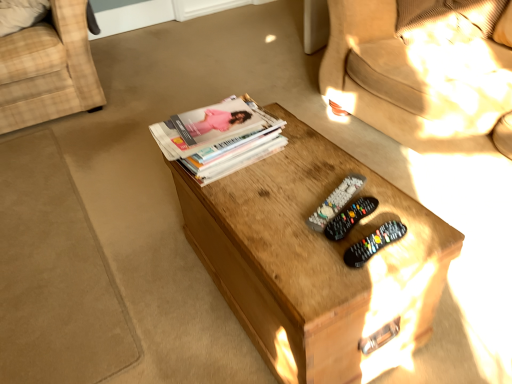
Question: Which direction should I rotate to look at black plastic remote control at center, marked as the second remote control in a back-to-front arrangement, — up or down?

Choices:
 (A) down
 (B) up

Answer: (A)

Question: Considering the relative sizes of plaid fabric chair at left and black plastic remote control at center, the 2th remote control positioned from the front, in the image provided, is plaid fabric chair at left wider than black plastic remote control at center, the 2th remote control positioned from the front,?

Choices:
 (A) no
 (B) yes

Answer: (B)

Question: Is plaid fabric chair at left at the right side of black plastic remote control at center, marked as the second remote control in a back-to-front arrangement?

Choices:
 (A) no
 (B) yes

Answer: (A)

Question: Can you confirm if plaid fabric chair at left is smaller than black plastic remote control at center, marked as the second remote control in a back-to-front arrangement?

Choices:
 (A) yes
 (B) no

Answer: (B)

Question: From the image's perspective, would you say plaid fabric chair at left is positioned over black plastic remote control at center, the 2th remote control positioned from the front?

Choices:
 (A) no
 (B) yes

Answer: (B)

Question: Is plaid fabric chair at left positioned with its back to black plastic remote control at center, the 2th remote control positioned from the front?

Choices:
 (A) yes
 (B) no

Answer: (B)

Question: Is plaid fabric chair at left next to black plastic remote control at center, marked as the second remote control in a back-to-front arrangement, and touching it?

Choices:
 (A) no
 (B) yes

Answer: (A)

Question: Does black plastic remote controls at center, acting as the third remote control starting from the back, have a larger size compared to plaid fabric chair at left?

Choices:
 (A) yes
 (B) no

Answer: (B)

Question: From a real-world perspective, is black plastic remote controls at center, acting as the third remote control starting from the back, located higher than plaid fabric chair at left?

Choices:
 (A) yes
 (B) no

Answer: (A)

Question: Is black plastic remote controls at center, acting as the third remote control starting from the back, positioned in front of plaid fabric chair at left?

Choices:
 (A) yes
 (B) no

Answer: (A)

Question: Is black plastic remote controls at center, which ranks as the first remote control in front-to-back order, facing towards plaid fabric chair at left?

Choices:
 (A) no
 (B) yes

Answer: (A)

Question: Is black plastic remote controls at center, which ranks as the first remote control in front-to-back order, with plaid fabric chair at left?

Choices:
 (A) yes
 (B) no

Answer: (B)

Question: Is black plastic remote controls at center, acting as the third remote control starting from the back, turned away from plaid fabric chair at left?

Choices:
 (A) no
 (B) yes

Answer: (A)

Question: Does black plastic remote control at center, marked as the second remote control in a back-to-front arrangement, appear on the right side of plaid fabric chair at left?

Choices:
 (A) no
 (B) yes

Answer: (B)